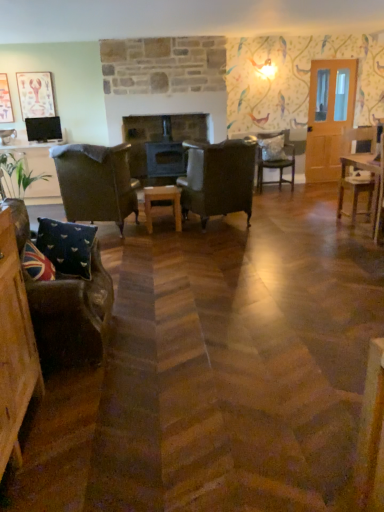
Question: Does wooden chair at right, which is the second chair from back to front, have a lesser width compared to wooden picture frame at upper left, the second picture frame from the right?

Choices:
 (A) yes
 (B) no

Answer: (B)

Question: From a real-world perspective, is wooden chair at right, which is the 1th chair from right to left, over wooden picture frame at upper left, the second picture frame from the right?

Choices:
 (A) no
 (B) yes

Answer: (A)

Question: From the image's perspective, is wooden chair at right, the 4th chair viewed from the front, beneath wooden picture frame at upper left, which is the first picture frame from left to right?

Choices:
 (A) yes
 (B) no

Answer: (A)

Question: Does wooden chair at right, placed as the 5th chair when sorted from left to right, have a larger size compared to wooden picture frame at upper left, the second picture frame from the right?

Choices:
 (A) yes
 (B) no

Answer: (A)

Question: Is wooden chair at right, which is the second chair from back to front, aimed at wooden picture frame at upper left, which is the first picture frame from left to right?

Choices:
 (A) yes
 (B) no

Answer: (B)

Question: Choose the correct answer: Is wooden picture frame at upper left, the second picture frame from the right, inside leather armchair at center, the 3th chair viewed from the left, or outside it?

Choices:
 (A) outside
 (B) inside

Answer: (A)

Question: From a real-world perspective, relative to leather armchair at center, which is counted as the 2th chair, starting from the front, is wooden picture frame at upper left, the second picture frame from the right, vertically above or below?

Choices:
 (A) below
 (B) above

Answer: (B)

Question: In terms of height, does wooden picture frame at upper left, the second picture frame from the right, look taller or shorter compared to leather armchair at center, which is counted as the 2th chair, starting from the front?

Choices:
 (A) tall
 (B) short

Answer: (B)

Question: Relative to leather armchair at center, the 3th chair viewed from the left, is wooden picture frame at upper left, the second picture frame from the right, in front or behind?

Choices:
 (A) front
 (B) behind

Answer: (B)

Question: Is union jack fabric pillow at lower left, which ranks as the first pillow in left-to-right order, in front of or behind matte pink picture frame at upper left, placed as the 2th picture frame when sorted from left to right, in the image?

Choices:
 (A) front
 (B) behind

Answer: (A)

Question: From the image's perspective, is union jack fabric pillow at lower left, the first pillow in the front-to-back sequence, positioned above or below matte pink picture frame at upper left, which is counted as the 1th picture frame, starting from the right?

Choices:
 (A) above
 (B) below

Answer: (B)

Question: Is union jack fabric pillow at lower left, which ranks as the first pillow in left-to-right order, taller or shorter than matte pink picture frame at upper left, which is counted as the 1th picture frame, starting from the right?

Choices:
 (A) short
 (B) tall

Answer: (A)

Question: Choose the correct answer: Is union jack fabric pillow at lower left, which ranks as the first pillow in left-to-right order, inside matte pink picture frame at upper left, placed as the 2th picture frame when sorted from left to right, or outside it?

Choices:
 (A) outside
 (B) inside

Answer: (A)

Question: Is wooden picture frame at upper left, the second picture frame from the right, taller or shorter than velvet union jack pillow at lower left, marked as the 2th pillow in a bottom-to-top arrangement?

Choices:
 (A) tall
 (B) short

Answer: (A)

Question: Considering their positions, is wooden picture frame at upper left, which is the first picture frame from left to right, located in front of or behind velvet union jack pillow at lower left, the 2th pillow when ordered from back to front?

Choices:
 (A) front
 (B) behind

Answer: (B)